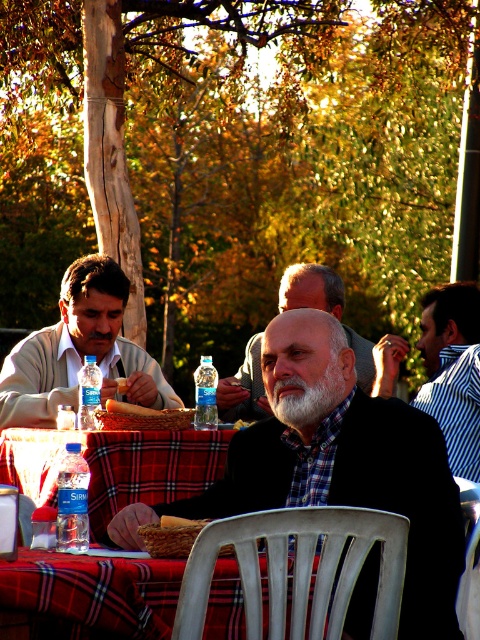
Question: Does gray wool sweater at center appear on the left side of whitehairbeard at center?

Choices:
 (A) no
 (B) yes

Answer: (A)

Question: Is matte gray sweater at left closer to the viewer compared to gray wool sweater at center?

Choices:
 (A) yes
 (B) no

Answer: (A)

Question: Which point appears farthest from the camera in this image?

Choices:
 (A) (48, 557)
 (B) (222, 472)

Answer: (B)

Question: Estimate the real-world distances between objects in this image. Which object is farther from the striped shirt at center?

Choices:
 (A) red plaid tablecloth at center
 (B) whitehairbeard at center
 (C) matte black jacket at center

Answer: (A)

Question: Can you confirm if matte black jacket at center is positioned below striped shirt at center?

Choices:
 (A) yes
 (B) no

Answer: (A)

Question: Which of the following is the closest to the observer?

Choices:
 (A) (210, 605)
 (B) (228, 404)
 (C) (444, 308)
 (D) (183, 416)

Answer: (A)